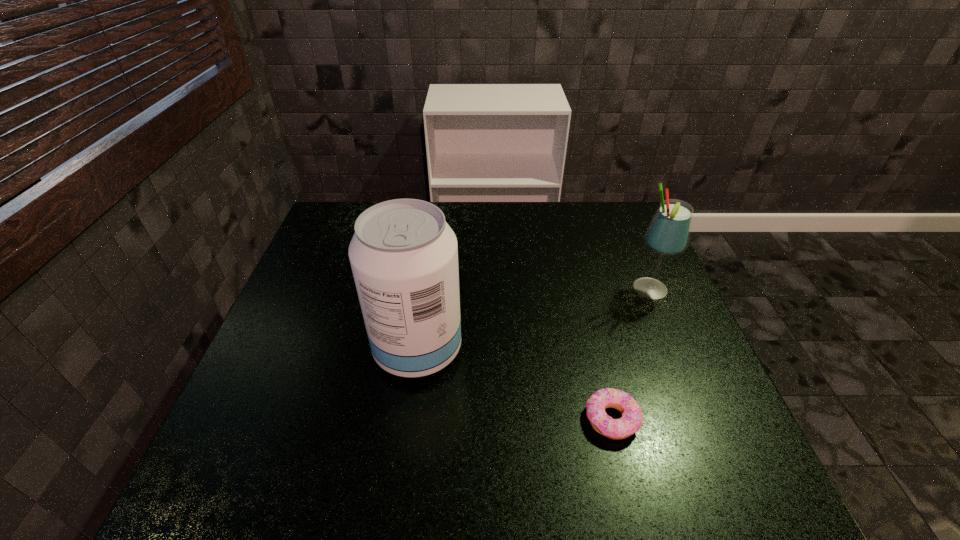
At what (x,y) coordinates should I click in order to perform the action: click on the left alcohol. Please return your answer as a coordinate pair (x, y). The image size is (960, 540). Looking at the image, I should click on pos(404,256).

Locate an element on the screen. The image size is (960, 540). the second nearest object is located at coordinates (404, 256).

This screenshot has height=540, width=960. I want to click on the right alcohol, so (x=668, y=234).

In order to click on the farther alcohol in this screenshot , I will do `click(668, 234)`.

The width and height of the screenshot is (960, 540). Identify the location of doughnut. (630, 422).

Locate an element on the screen. the second object from left to right is located at coordinates (630, 422).

Image resolution: width=960 pixels, height=540 pixels. What are the coordinates of `vacant space located on the back of the leftmost object` in the screenshot? It's located at (434, 232).

Where is `blank space located on the left of the farthest object`? blank space located on the left of the farthest object is located at coordinates (541, 289).

Find the location of a particular element. Image resolution: width=960 pixels, height=540 pixels. vacant space located on the left of the doughnut is located at coordinates (492, 418).

This screenshot has height=540, width=960. What are the coordinates of `object that is at the right edge` in the screenshot? It's located at (668, 234).